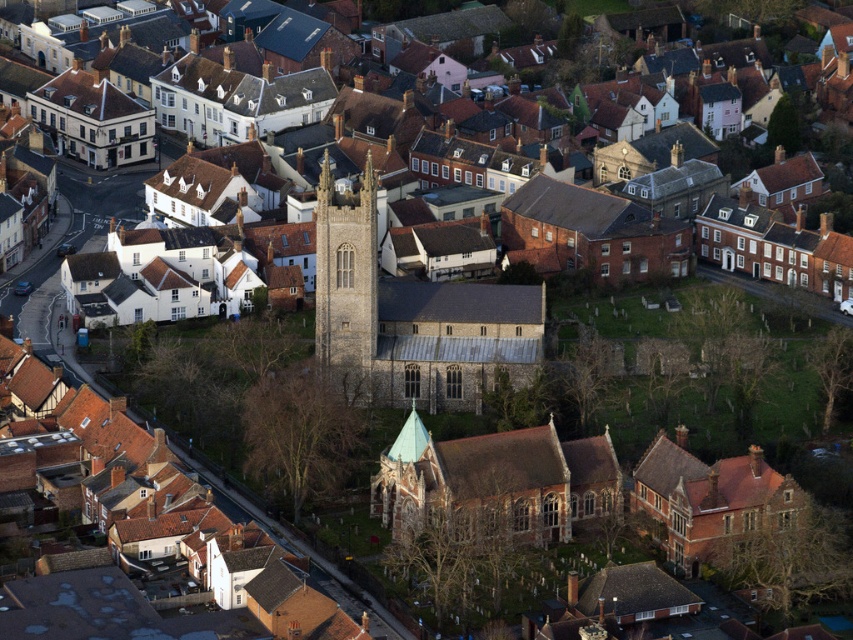
You are a drone operator flying over the town. You need to capture a photo of both the brown brick church at lower center and the dark gray stone tower at center. Which object should you focus on first if you want to ensure both are in the frame?

The brown brick church at lower center is larger in size than the dark gray stone tower at center, so you should focus on the brown brick church at lower center first to ensure both fit within the frame.

You are a drone operator tasked with capturing aerial footage of the town. Your drone has a battery that lasts for 10 minutes and can travel at a speed of 15 feet per minute. You need to fly from the brown brick church at lower center to the stone church at center and return. Is there enough battery to complete the round trip?

The brown brick church at lower center is 50.20 feet from the stone church at center. The round trip distance is 100.40 feet. At 15 feet per minute, the drone would take approximately 6.69 minutes to complete the round trip, which is within the 10 minute battery life. Therefore, there is enough battery to complete the round trip.